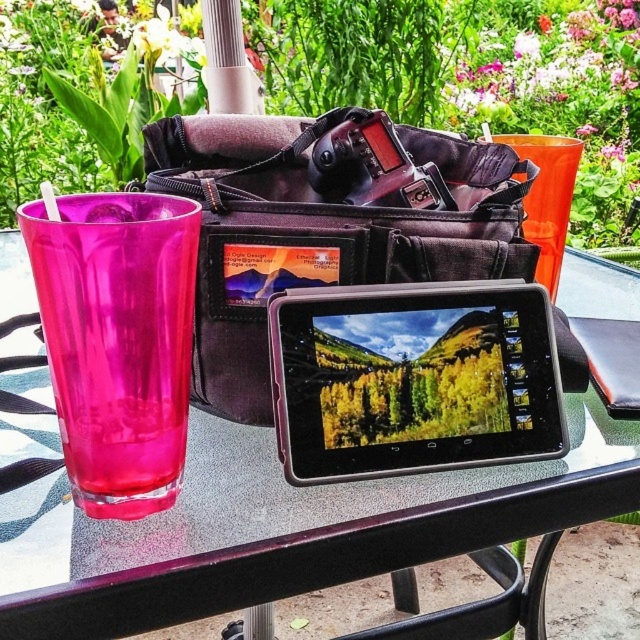
Is black plastic tablet at center to the right of transparent plastic cup at left from the viewer's perspective?

Correct, you'll find black plastic tablet at center to the right of transparent plastic cup at left.

Does black plastic tablet at center have a greater width compared to transparent plastic cup at left?

Correct, the width of black plastic tablet at center exceeds that of transparent plastic cup at left.

Between point (438, 401) and point (60, 380), which one is positioned behind?

The point (438, 401) is behind.

I want to click on black plastic tablet at center, so click(x=412, y=378).

Which is below, transparent glass at upper left or black plastic tablet at center?

black plastic tablet at center is lower down.

Who is more forward, (579, 305) or (378, 376)?

Point (378, 376) is in front.

Where is `transparent glass at upper left`? transparent glass at upper left is located at coordinates (284, 529).

Is matte black bag at center closer to the viewer compared to transparent plastic cup at left?

No, matte black bag at center is further to the viewer.

Is point (401, 220) positioned before point (129, 257)?

No, it is not.

Who is more forward, (444,163) or (49,275)?

Point (49,275) is more forward.

The image size is (640, 640). What are the coordinates of `matte black bag at center` in the screenshot? It's located at (317, 230).